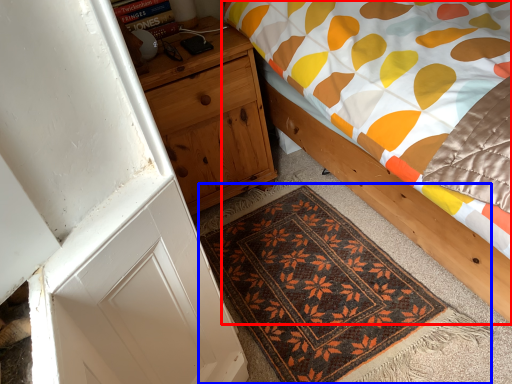
Question: Which point is closer to the camera, bed (highlighted by a red box) or mat (highlighted by a blue box)?

Choices:
 (A) bed
 (B) mat

Answer: (A)